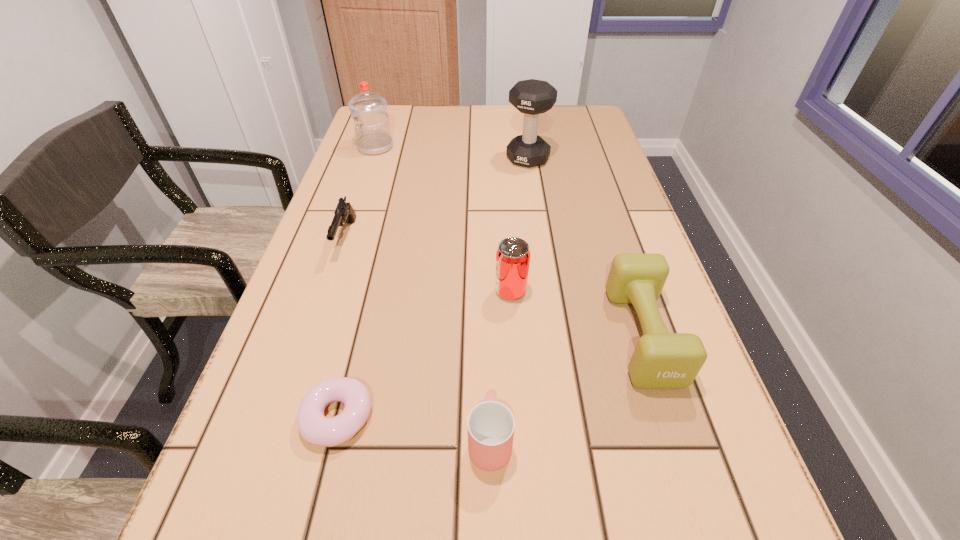
This screenshot has width=960, height=540. I want to click on the taller dumbbell, so click(532, 97).

You are a GUI agent. You are given a task and a screenshot of the screen. Output one action in this format:
    pyautogui.click(x=<x>, y=<y>)
    Task: Click on the farther dumbbell
    
    Given the screenshot: What is the action you would take?
    pyautogui.click(x=532, y=97)

This screenshot has width=960, height=540. Find the location of `water bottle`. water bottle is located at coordinates (373, 136).

I want to click on the third tallest object, so click(x=513, y=255).

Locate an element on the screen. The width and height of the screenshot is (960, 540). the nearer dumbbell is located at coordinates (661, 360).

Find the location of `the shorter dumbbell`. the shorter dumbbell is located at coordinates (661, 360).

Find the location of a particular element. The width and height of the screenshot is (960, 540). the fifth nearest object is located at coordinates (344, 213).

You are a GUI agent. You are given a task and a screenshot of the screen. Output one action in this format:
    pyautogui.click(x=<x>, y=<y>)
    Task: Click on the cup
    The height and width of the screenshot is (540, 960).
    Given the screenshot: What is the action you would take?
    pyautogui.click(x=490, y=424)

Identify the location of the shortest object. (315, 428).

This screenshot has width=960, height=540. Identify the location of free space located on the back of the left dumbbell. (524, 132).